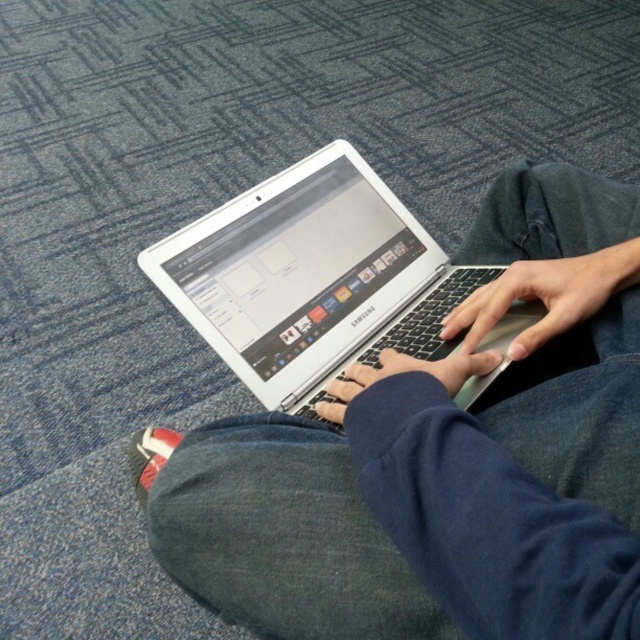
Question: Which of the following is the farthest from the observer?

Choices:
 (A) (392, 224)
 (B) (390, 470)

Answer: (A)

Question: Which point is closer to the camera?

Choices:
 (A) (320, 502)
 (B) (291, 337)

Answer: (A)

Question: Is white glossy laptop at center bigger than silver metallic laptop at center?

Choices:
 (A) no
 (B) yes

Answer: (B)

Question: Is white glossy laptop at center thinner than silver metallic laptop at center?

Choices:
 (A) yes
 (B) no

Answer: (B)

Question: Can you confirm if white glossy laptop at center is thinner than silver metallic laptop at center?

Choices:
 (A) no
 (B) yes

Answer: (A)